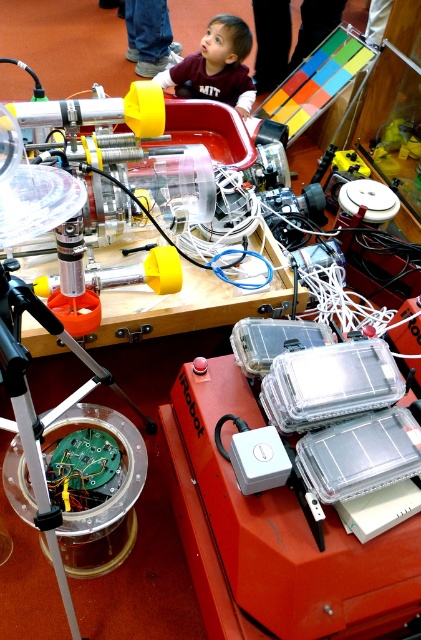
You are a researcher in the robotics lab and need to place a small electronic component on the silver metallic tripod at lower left. Where exactly should you place it?

You should place the small electronic component at point (66, 451) on the silver metallic tripod at lower left.

You are a technician inspecting the modified Roomba. You notice two points marked on the image at coordinates point [111,410] and point [224,83]. Which point is nearer to your viewpoint?

Point [111,410] is closer to the camera than point [224,83].

You are a technician working on a robotics project. You need to locate the point marked at coordinates (66, 451) in the image. Where exactly is this point located?

The point marked at coordinates (66, 451) is located on the silver metallic tripod at lower left.